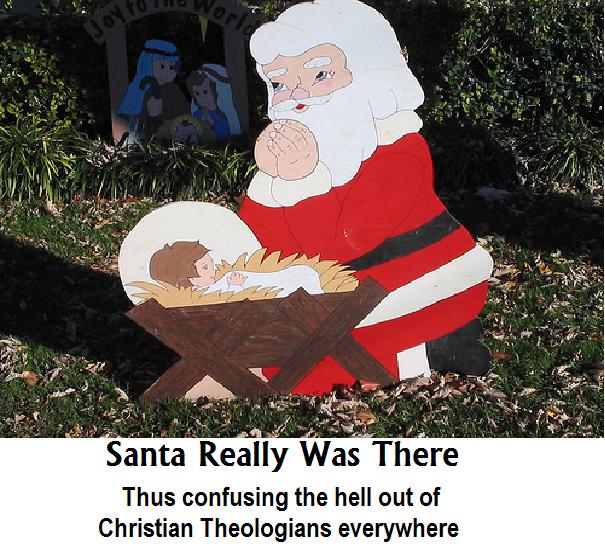
Identify the location of wood basket. click(270, 335).